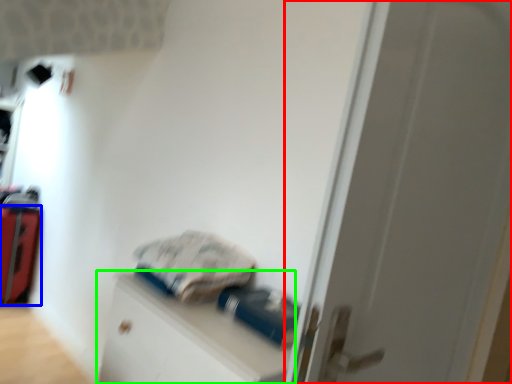
Question: Considering the real-world distances, which object is farthest from door (highlighted by a red box)? luggage (highlighted by a blue box) or file cabinet (highlighted by a green box)?

Choices:
 (A) luggage
 (B) file cabinet

Answer: (A)